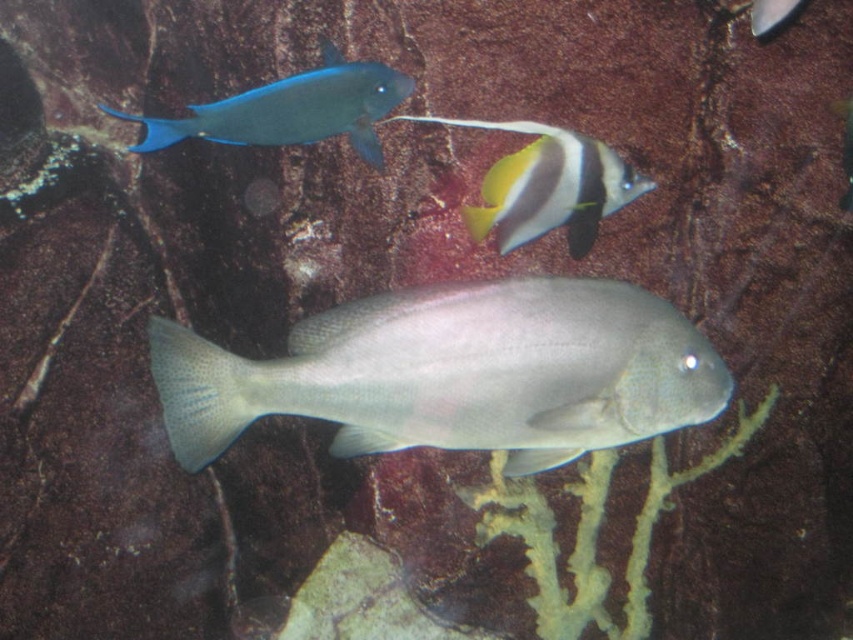
Question: Which point is closer to the camera?

Choices:
 (A) (560, 164)
 (B) (201, 378)
 (C) (331, 115)
 (D) (762, 24)

Answer: (B)

Question: Among these objects, which one is farthest from the camera?

Choices:
 (A) yellow-black striped fin at center
 (B) shiny blue fish at upper left

Answer: (B)

Question: Is yellow-black striped fin at center closer to the viewer compared to shiny blue fish at upper left?

Choices:
 (A) no
 (B) yes

Answer: (B)

Question: Is yellow-black striped fin at center closer to camera compared to shiny blue fish at upper left?

Choices:
 (A) no
 (B) yes

Answer: (B)

Question: Which point is closer to the camera?

Choices:
 (A) (381, 301)
 (B) (764, 19)
 (C) (485, 198)

Answer: (A)

Question: Does shiny blue fish at upper left appear on the left side of shiny silver fish at upper right?

Choices:
 (A) no
 (B) yes

Answer: (B)